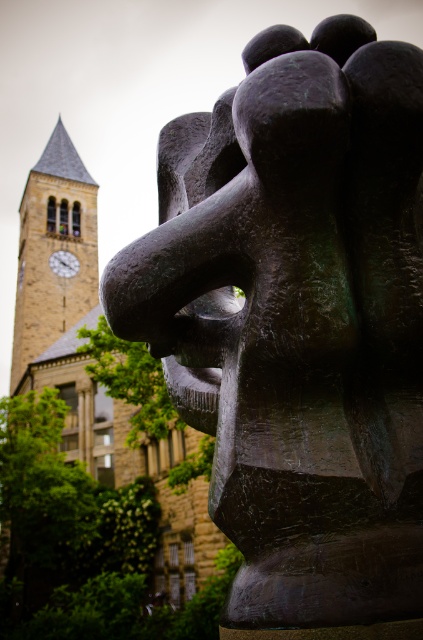
In the scene shown: You are an architect analyzing the image of a sculpture in front of a building. You need to determine which structure is larger between the brown stone church at center and the brown stone clock tower at upper left. Based on the scene, which one is larger?

The brown stone church at center is bigger than the brown stone clock tower at upper left, so the church is larger.